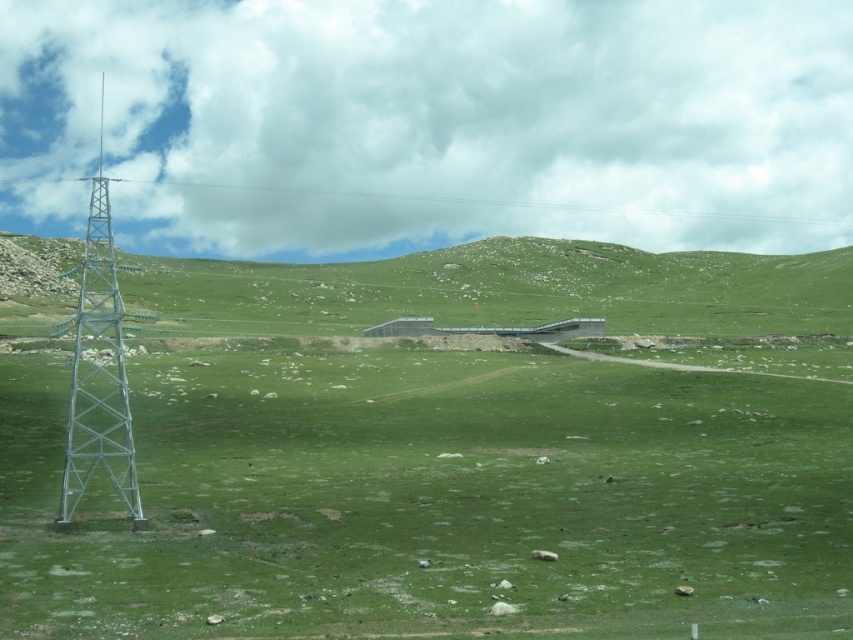
You are standing at the base of the metallic tower and want to walk to the small building in the midground. Which direction should you head relative to the green grassy field at center and the green grassy hillside at center?

You should head to the right of the green grassy hillside at center, as the green grassy field at center is located to the right of it, and the path leading to the building is likely in that direction.

You are a hiker planning to cross the area shown in the image. You need to choose between the green grassy field at center and the green grassy hillside at center for your path. Which area would you choose if you want to cover more ground with fewer steps?

The green grassy hillside at center occupies more space than the green grassy field at center, so choosing it would allow you to cover more ground with fewer steps.

Looking at this image, you are standing on the green grassy field at center and want to reach the metallic silver tower at left. Considering the height difference between them, which object would you need to climb over or go around?

The metallic silver tower at left is taller than the green grassy field at center, so you would need to climb over or navigate around the metallic silver tower at left.